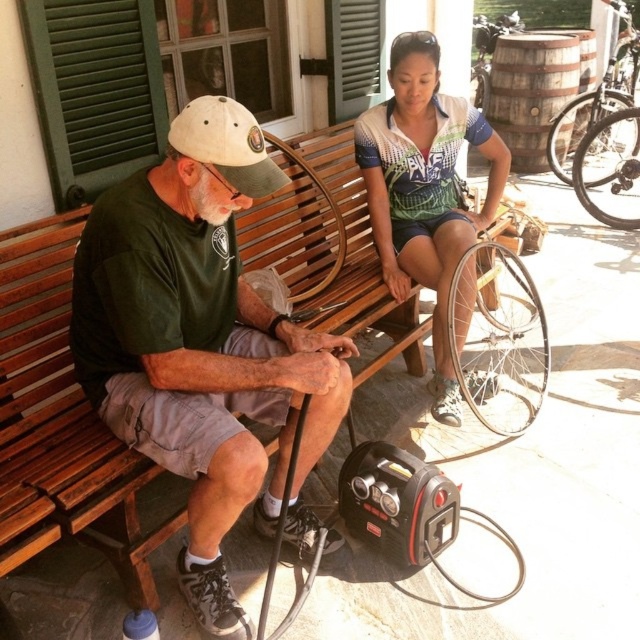
Question: Estimate the real-world distances between objects in this image. Which object is farther from the white jersey at upper center?

Choices:
 (A) white matte baseball cap at left
 (B) green fabric shirt at left

Answer: (A)

Question: Which point is farther to the camera?

Choices:
 (A) silver metallic bicycle wheel at right
 (B) white matte baseball cap at left
 (C) white jersey at upper center

Answer: (A)

Question: Which object is closer to the camera taking this photo?

Choices:
 (A) green fabric shirt at left
 (B) silver metallic bicycle wheel at right
 (C) white matte baseball cap at left
 (D) white jersey at upper center

Answer: (C)

Question: Does green fabric shirt at left appear on the right side of white matte baseball cap at left?

Choices:
 (A) no
 (B) yes

Answer: (A)

Question: Does white matte baseball cap at left have a greater width compared to silver metallic bicycle wheel at right?

Choices:
 (A) no
 (B) yes

Answer: (A)

Question: Is the position of white jersey at upper center more distant than that of silver metallic bicycle wheel at right?

Choices:
 (A) no
 (B) yes

Answer: (A)